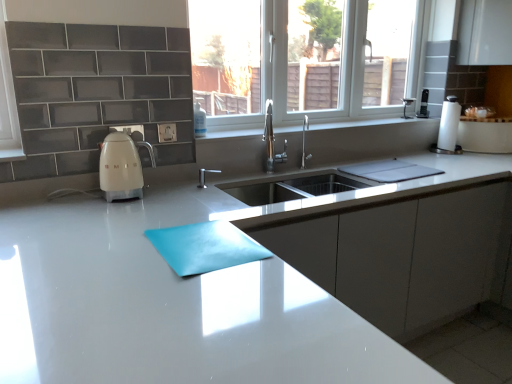
Image resolution: width=512 pixels, height=384 pixels. In order to click on vacant space underneath white glossy window sill at center (from a real-world perspective) in this screenshot , I will do `click(337, 124)`.